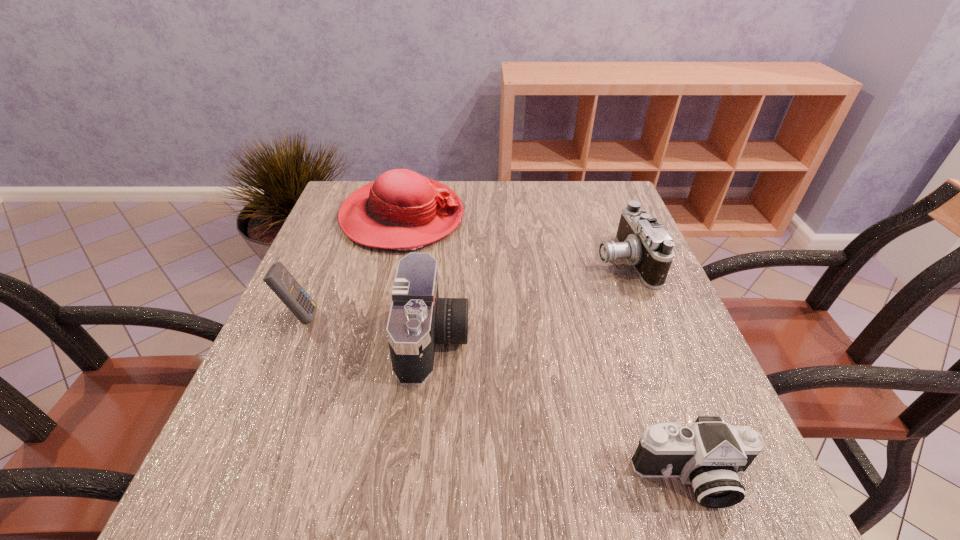
What are the coordinates of `free space located 0.290m at the lens of the farthest camera` in the screenshot? It's located at (471, 260).

The width and height of the screenshot is (960, 540). In order to click on free point located 0.090m on the back of the nearest object in this screenshot , I will do `click(661, 399)`.

This screenshot has height=540, width=960. I want to click on object that is positioned at the far edge, so click(x=402, y=210).

Where is `object situated at the near edge`? Image resolution: width=960 pixels, height=540 pixels. object situated at the near edge is located at coordinates (710, 455).

I want to click on hat present at the left edge, so click(402, 210).

This screenshot has height=540, width=960. I want to click on calculator that is at the left edge, so click(278, 278).

Locate an element on the screen. The width and height of the screenshot is (960, 540). object present at the far left corner is located at coordinates (402, 210).

The width and height of the screenshot is (960, 540). I want to click on object that is at the near right corner, so click(710, 455).

In the image, there is a desktop. In order to click on vacant space at the far edge in this screenshot , I will do `click(461, 198)`.

You are a GUI agent. You are given a task and a screenshot of the screen. Output one action in this format:
    pyautogui.click(x=<x>, y=<y>)
    Task: Click on the vacant space at the near edge
    The image size is (960, 540).
    Given the screenshot: What is the action you would take?
    pyautogui.click(x=462, y=478)